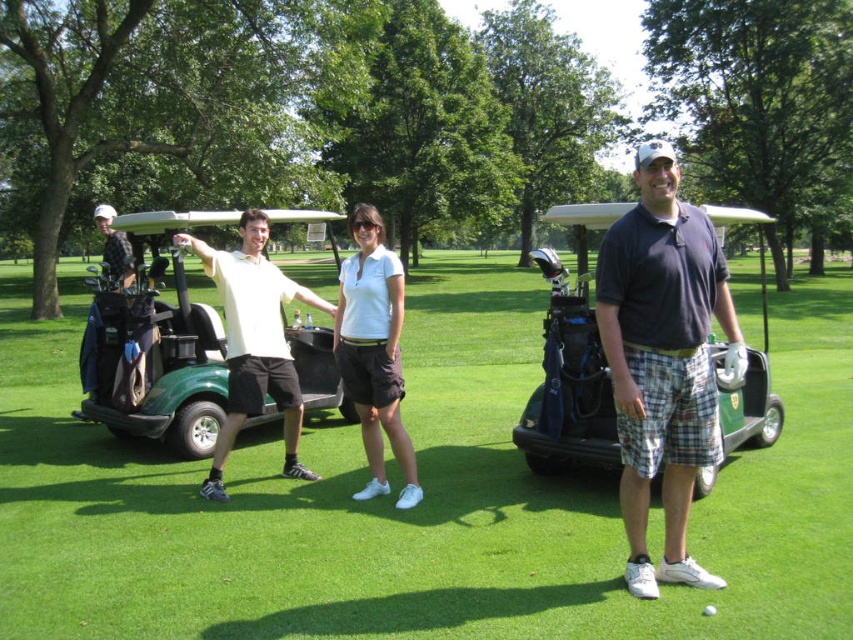
Is green grass at center shorter than dark blue fabric golf cart at center?

No.

Who is higher up, green grass at center or dark blue fabric golf cart at center?

green grass at center

Locate an element on the screen. green grass at center is located at coordinates (419, 504).

Locate an element on the screen. The height and width of the screenshot is (640, 853). green grass at center is located at coordinates [419, 504].

Measure the distance from green grass at center to green matte golf cart at left.

green grass at center and green matte golf cart at left are 5.13 meters apart from each other.

Which of these two, green grass at center or green matte golf cart at left, stands shorter?

Standing shorter between the two is green grass at center.

This screenshot has height=640, width=853. What are the coordinates of `green grass at center` in the screenshot? It's located at (419, 504).

Based on the photo, who is positioned more to the left, dark blue polo shirt at center or matte black golf bag at left?

matte black golf bag at left is more to the left.

Between dark blue polo shirt at center and matte black golf bag at left, which one is positioned lower?

A: dark blue polo shirt at center

Measure the distance between dark blue polo shirt at center and camera.

dark blue polo shirt at center is 12.48 feet from camera.

Where is `dark blue polo shirt at center`? The image size is (853, 640). dark blue polo shirt at center is located at coordinates (663, 358).